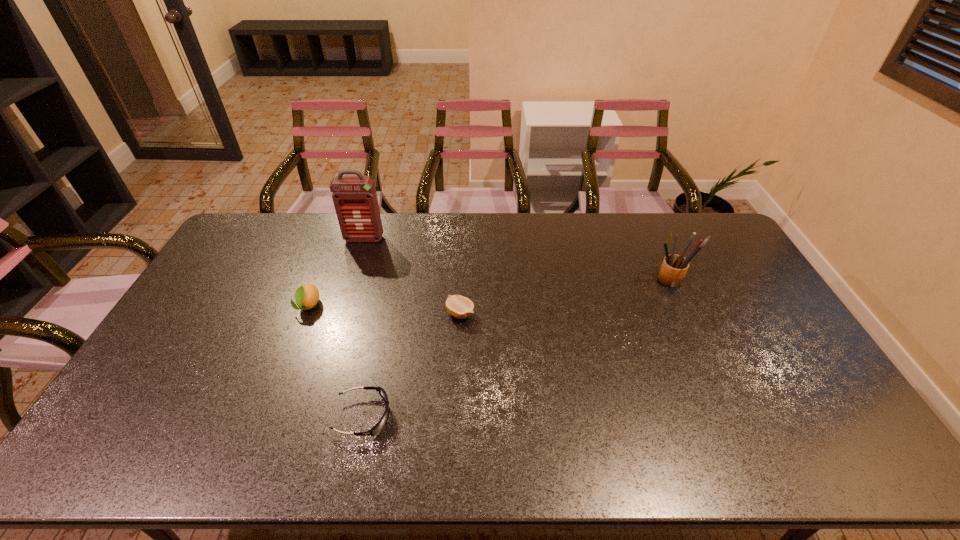
This screenshot has width=960, height=540. I want to click on blank area located 0.190m on the front of the rightmost object, so click(x=694, y=335).

At what (x,y) coordinates should I click in order to perform the action: click on vacant area located with leaves positioned above the third tallest object. Please return your answer as a coordinate pair (x, y). Looking at the image, I should click on click(x=258, y=434).

In order to click on vacant space located 0.060m on the left of the second object from right to left in this screenshot , I will do `click(427, 314)`.

This screenshot has width=960, height=540. Find the location of `free spot located 0.330m on the front and sides of the goggles`. free spot located 0.330m on the front and sides of the goggles is located at coordinates (519, 416).

This screenshot has width=960, height=540. Find the location of `object at the far edge`. object at the far edge is located at coordinates (355, 200).

Where is `object positioned at the near edge`? This screenshot has height=540, width=960. object positioned at the near edge is located at coordinates (378, 427).

In the image, there is a desktop. At what (x,y) coordinates should I click in order to perform the action: click on vacant area at the far edge. Please return your answer as a coordinate pair (x, y). The image size is (960, 540). Looking at the image, I should click on (532, 233).

The width and height of the screenshot is (960, 540). I want to click on vacant space at the near edge of the desktop, so click(181, 436).

The image size is (960, 540). I want to click on free point at the left edge, so click(156, 427).

Locate an element on the screen. vacant space at the right edge of the desktop is located at coordinates (780, 330).